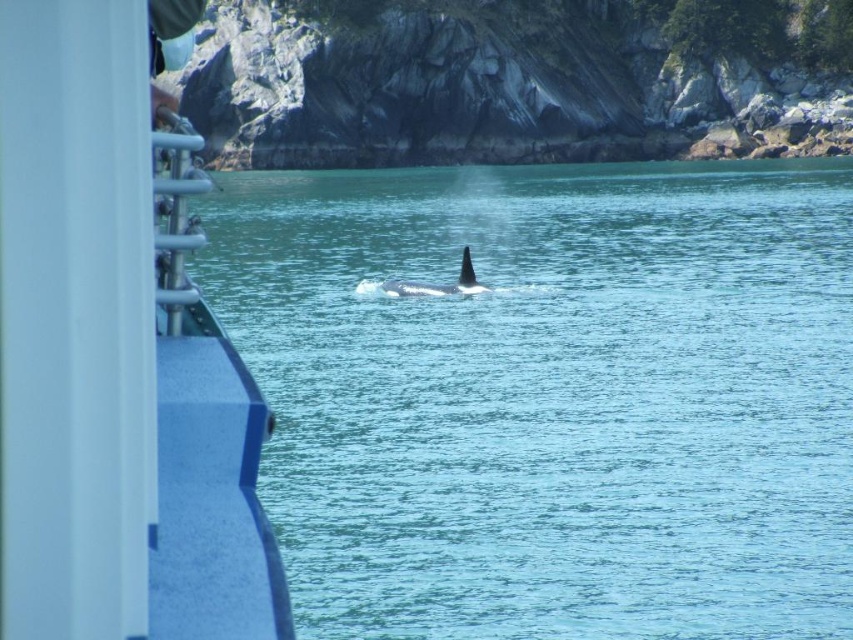
Question: Is clear blue water at center further to the viewer compared to blue rubber boat at left?

Choices:
 (A) yes
 (B) no

Answer: (A)

Question: Is clear blue water at center closer to the viewer compared to blue rubber boat at left?

Choices:
 (A) no
 (B) yes

Answer: (A)

Question: Which object appears closest to the camera in this image?

Choices:
 (A) black smooth whale at center
 (B) blue rubber boat at left
 (C) clear blue water at center

Answer: (B)

Question: Does blue rubber boat at left appear on the right side of black smooth whale at center?

Choices:
 (A) no
 (B) yes

Answer: (A)

Question: Which point appears closest to the camera in this image?

Choices:
 (A) (753, 269)
 (B) (212, 314)

Answer: (B)

Question: Which object is closer to the camera taking this photo?

Choices:
 (A) clear blue water at center
 (B) black smooth whale at center
 (C) blue rubber boat at left

Answer: (C)